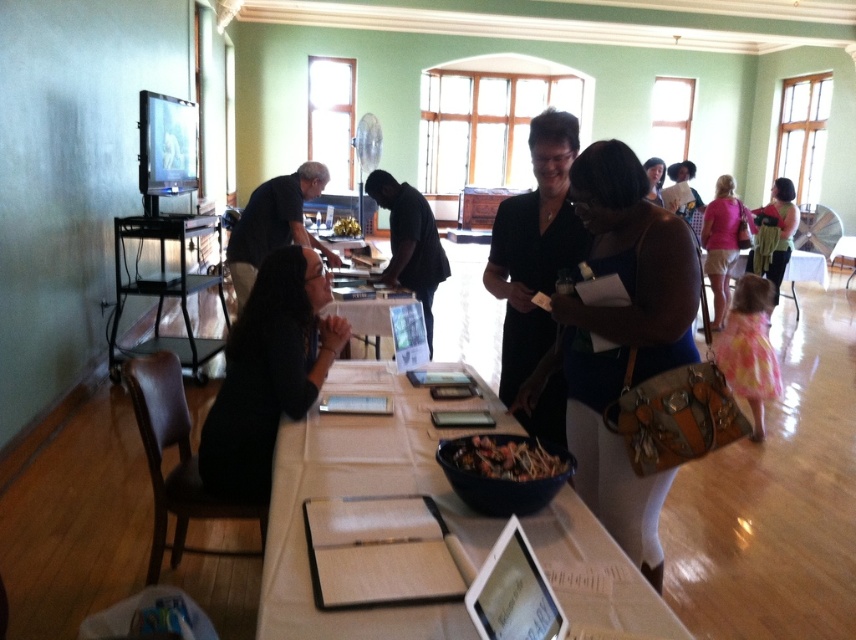
Question: Is black matte dress at center above shiny metallic bowl at center?

Choices:
 (A) yes
 (B) no

Answer: (A)

Question: From the image, what is the correct spatial relationship of white paper at center in relation to black matte dress at center?

Choices:
 (A) above
 (B) below

Answer: (B)

Question: Which point appears closest to the camera in this image?

Choices:
 (A) (276, 349)
 (B) (756, 218)
 (C) (703, 212)
 (D) (483, 445)

Answer: (D)

Question: Is black matte dress at center positioned before shiny metallic bowl at center?

Choices:
 (A) yes
 (B) no

Answer: (B)

Question: Estimate the real-world distances between objects in this image. Which object is closer to the matte black dress at center?

Choices:
 (A) green textured dress at center
 (B) white paper at center

Answer: (B)

Question: Which object is positioned closest to the pink fabric dress at center?

Choices:
 (A) matte black dress at center
 (B) shiny metallic bowl at center
 (C) white paper at center

Answer: (A)